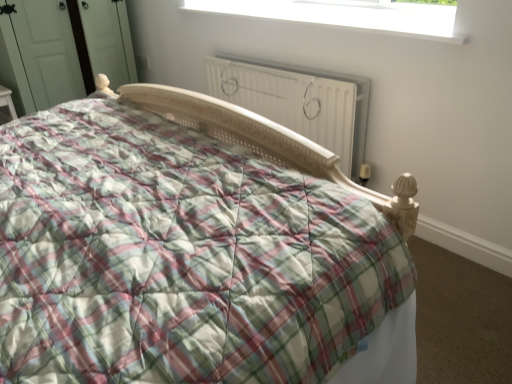
Question: Is plaid fabric bed at center at the left side of white plastic window at upper center?

Choices:
 (A) no
 (B) yes

Answer: (B)

Question: From a real-world perspective, does plaid fabric bed at center sit lower than white plastic window at upper center?

Choices:
 (A) no
 (B) yes

Answer: (B)

Question: Does plaid fabric bed at center appear on the right side of white plastic window at upper center?

Choices:
 (A) yes
 (B) no

Answer: (B)

Question: Is plaid fabric bed at center not within white plastic window at upper center?

Choices:
 (A) yes
 (B) no

Answer: (A)

Question: Could white plastic window at upper center be considered to be inside plaid fabric bed at center?

Choices:
 (A) yes
 (B) no

Answer: (B)

Question: From a real-world perspective, relative to white matte radiator at center, is white plastic window at upper center vertically above or below?

Choices:
 (A) below
 (B) above

Answer: (B)

Question: Is point (283, 8) positioned closer to the camera than point (286, 77)?

Choices:
 (A) closer
 (B) farther

Answer: (B)

Question: Is white plastic window at upper center wider or thinner than white matte radiator at center?

Choices:
 (A) thin
 (B) wide

Answer: (B)

Question: From the image's perspective, is white plastic window at upper center positioned above or below white matte radiator at center?

Choices:
 (A) below
 (B) above

Answer: (B)

Question: Is point [438, 23] closer or farther from the camera than point [146, 241]?

Choices:
 (A) closer
 (B) farther

Answer: (B)

Question: From a real-world perspective, is white plastic window at upper center physically located above or below plaid fabric bed at center?

Choices:
 (A) below
 (B) above

Answer: (B)

Question: Considering their positions, is white plastic window at upper center located in front of or behind plaid fabric bed at center?

Choices:
 (A) behind
 (B) front

Answer: (A)

Question: In terms of height, does white plastic window at upper center look taller or shorter compared to plaid fabric bed at center?

Choices:
 (A) short
 (B) tall

Answer: (A)

Question: From a real-world perspective, relative to white matte radiator at center, is plaid fabric bed at center vertically above or below?

Choices:
 (A) below
 (B) above

Answer: (B)

Question: Is point [36, 345] closer or farther from the camera than point [297, 77]?

Choices:
 (A) farther
 (B) closer

Answer: (B)